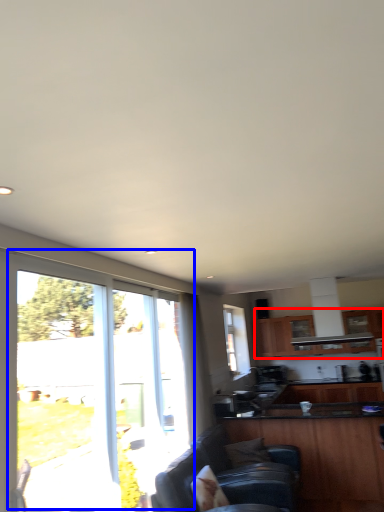
Question: Which point is further to the camera, cabinetry (highlighted by a red box) or window (highlighted by a blue box)?

Choices:
 (A) cabinetry
 (B) window

Answer: (A)